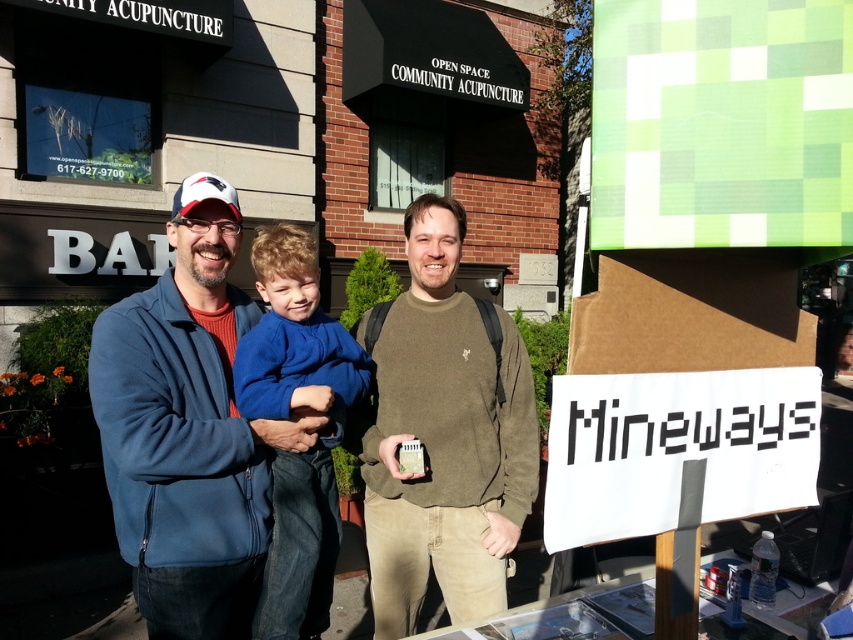
Is blue fleece jacket at left taller than matte white baseball cap at upper left?

Yes, blue fleece jacket at left is taller than matte white baseball cap at upper left.

Does blue fleece jacket at left have a larger size compared to matte white baseball cap at upper left?

Answer: Yes.

What are the coordinates of `blue fleece jacket at left` in the screenshot? It's located at (189, 436).

Is blue fleece jacket at left wider than green matte sweater at center?

In fact, blue fleece jacket at left might be narrower than green matte sweater at center.

Who is positioned more to the left, blue fleece jacket at left or green matte sweater at center?

From the viewer's perspective, blue fleece jacket at left appears more on the left side.

Where is `blue fleece jacket at left`? blue fleece jacket at left is located at coordinates (189, 436).

Between point (479, 378) and point (294, 243), which one is positioned behind?

The point (479, 378) is more distant.

What do you see at coordinates (444, 435) in the screenshot? I see `green matte sweater at center` at bounding box center [444, 435].

Is point (393, 339) positioned before point (276, 600)?

No, it is not.

The height and width of the screenshot is (640, 853). What are the coordinates of `green matte sweater at center` in the screenshot? It's located at (444, 435).